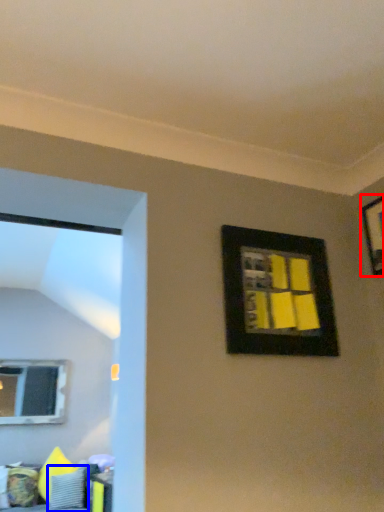
Question: Which of the following is the farthest to the observer, picture frame (highlighted by a red box) or pillow (highlighted by a blue box)?

Choices:
 (A) picture frame
 (B) pillow

Answer: (B)